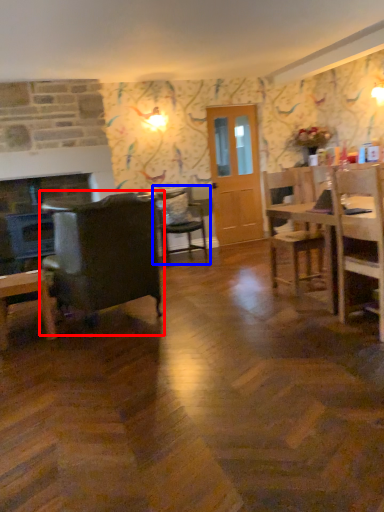
Question: Which object is closer to the camera taking this photo, chair (highlighted by a red box) or chair (highlighted by a blue box)?

Choices:
 (A) chair
 (B) chair

Answer: (A)